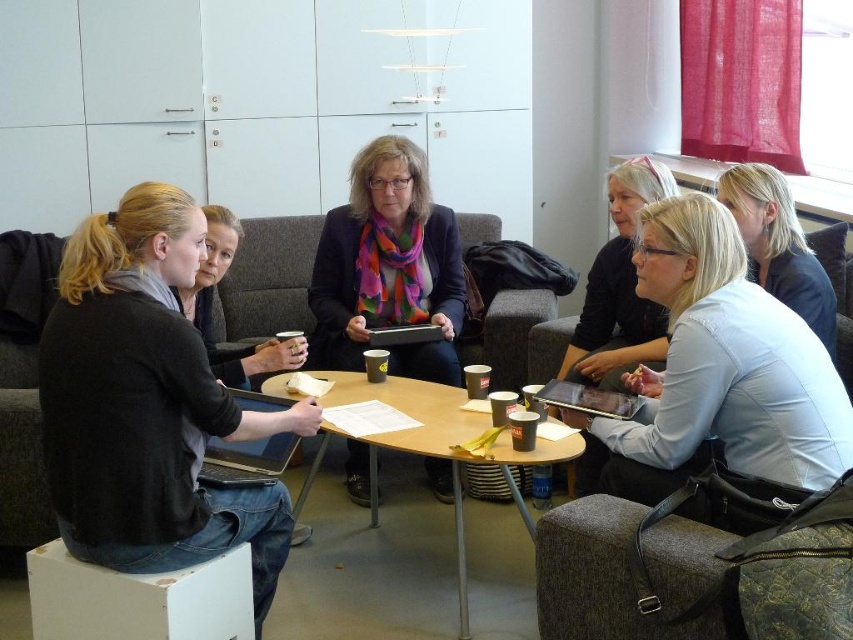
Consider the image. You are organizing a presentation and need to move your matte black laptop at left closer to the wooden table at center. Which direction should you move it to align it properly?

The matte black laptop at left is currently to the left of the wooden table at center. To align it properly, move it to the right towards the wooden table at center.

You are a delivery person who needs to place a 1.5 meter long package between the matte black laptop at left and the blonde hair at upper right. Can you fit it there?

The distance between the matte black laptop at left and blonde hair at upper right is 1.63 meters, so the 1.5 meter long package can fit between them with some space to spare.

You are organizing a presentation and need to place both the matte black laptop at left and the matte black jacket at center on a desk. Which object should you place first to ensure they both fit on the desk?

The matte black laptop at left is larger in size than the matte black jacket at center. Therefore, you should place the matte black laptop at left first to ensure both items fit on the desk.